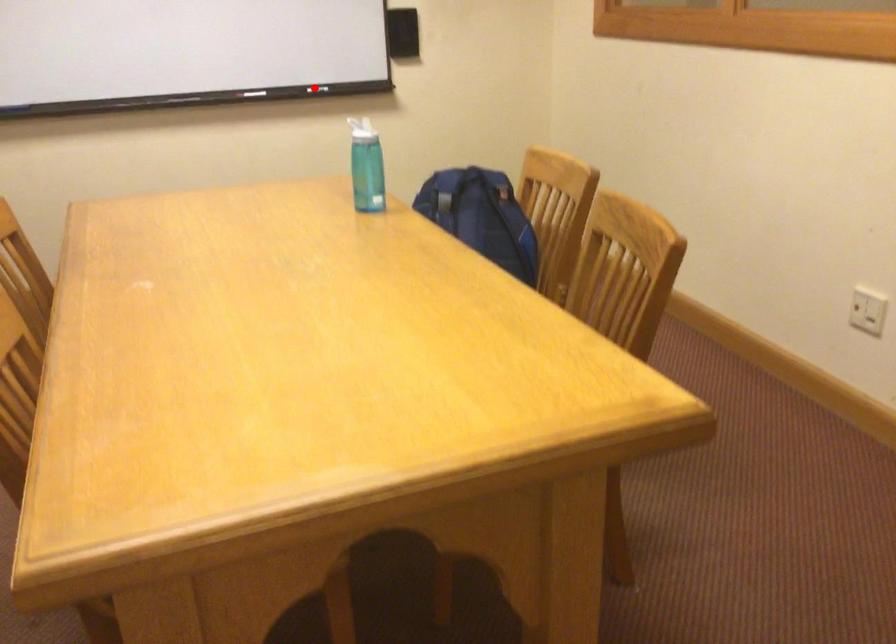
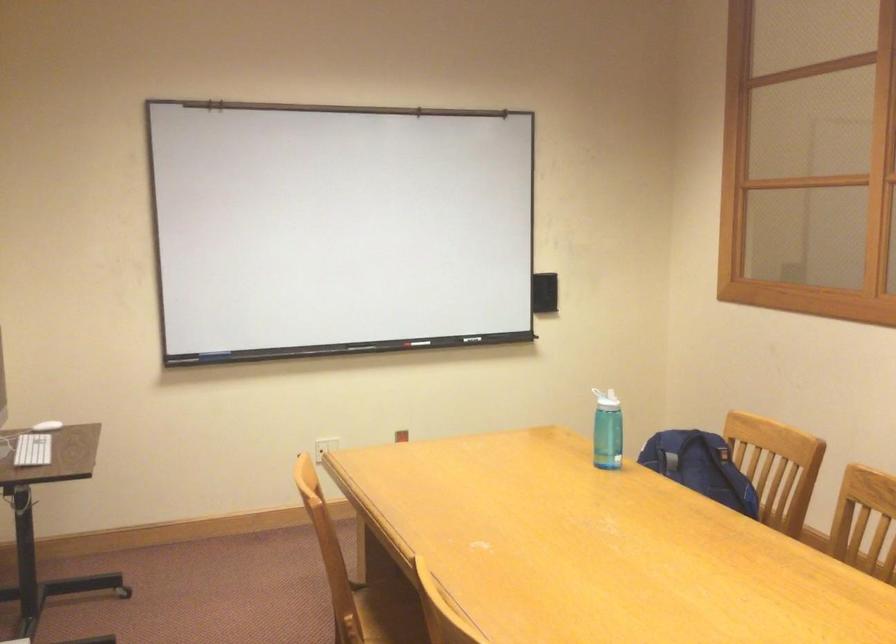
Question: I am providing you with two images of the same scene from different viewpoints. A red point is marked on the first image. At the location where the point appears in image 1, is it still visible in image 2?

Choices:
 (A) Yes
 (B) No

Answer: (A)